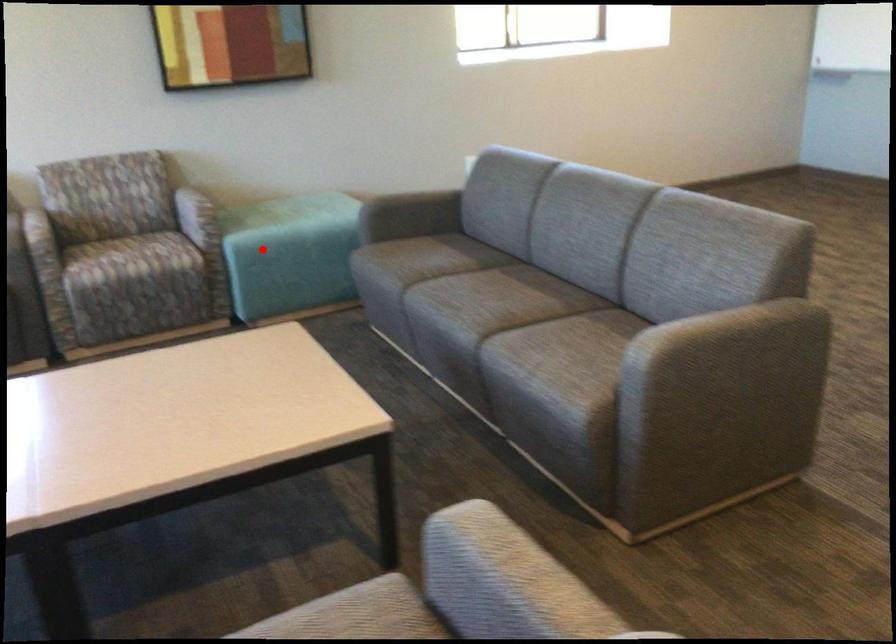
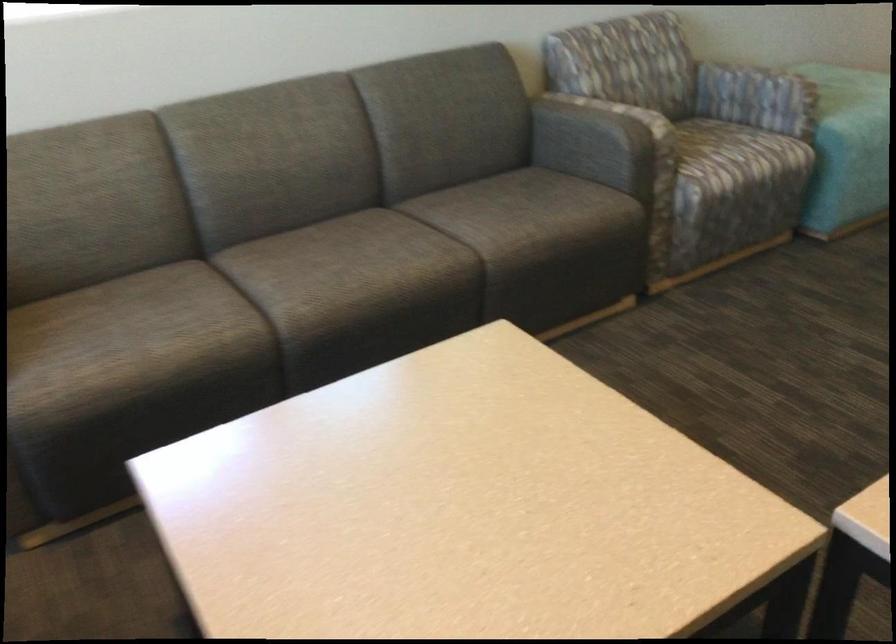
Question: I am providing you with two images of the same scene from different viewpoints. Given a red point in image1, look at the same physical point in image2. Is it:

Choices:
 (A) Closer to the viewpoint
 (B) Farther from the viewpoint

Answer: (A)